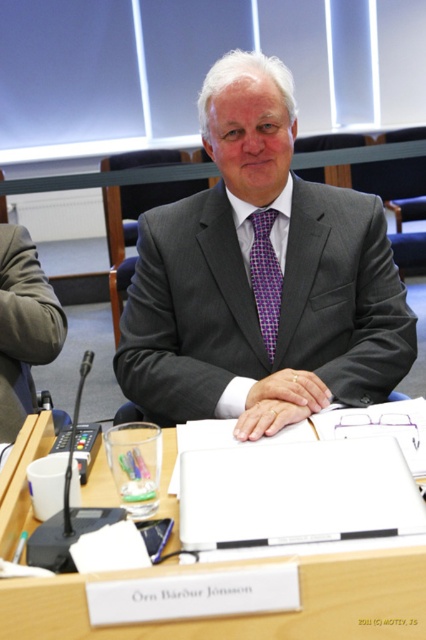
Question: Among these objects, which one is farthest from the camera?

Choices:
 (A) matte black suit at center
 (B) wooden table at center
 (C) purple checkered tie at center

Answer: (C)

Question: Does gray textured suit at center appear on the left side of wooden table at center?

Choices:
 (A) no
 (B) yes

Answer: (A)

Question: Can you confirm if gray textured suit at center is smaller than matte black suit at center?

Choices:
 (A) yes
 (B) no

Answer: (B)

Question: Among these objects, which one is nearest to the camera?

Choices:
 (A) wooden table at center
 (B) purple checkered tie at center
 (C) gray textured suit at center
 (D) matte black suit at center

Answer: (A)

Question: Can you confirm if wooden table at center is thinner than matte black suit at center?

Choices:
 (A) no
 (B) yes

Answer: (A)

Question: Among these objects, which one is farthest from the camera?

Choices:
 (A) matte black suit at center
 (B) purple checkered tie at center

Answer: (B)